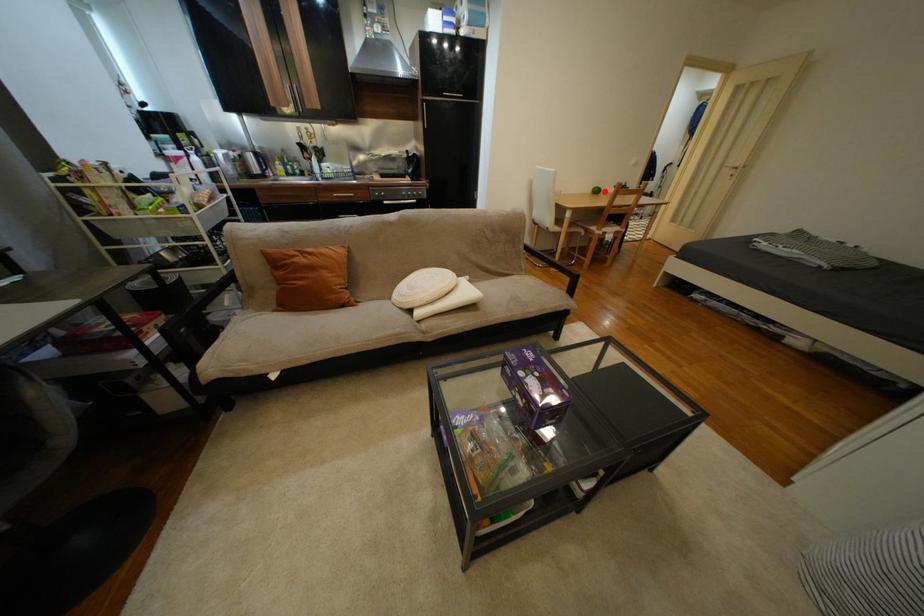
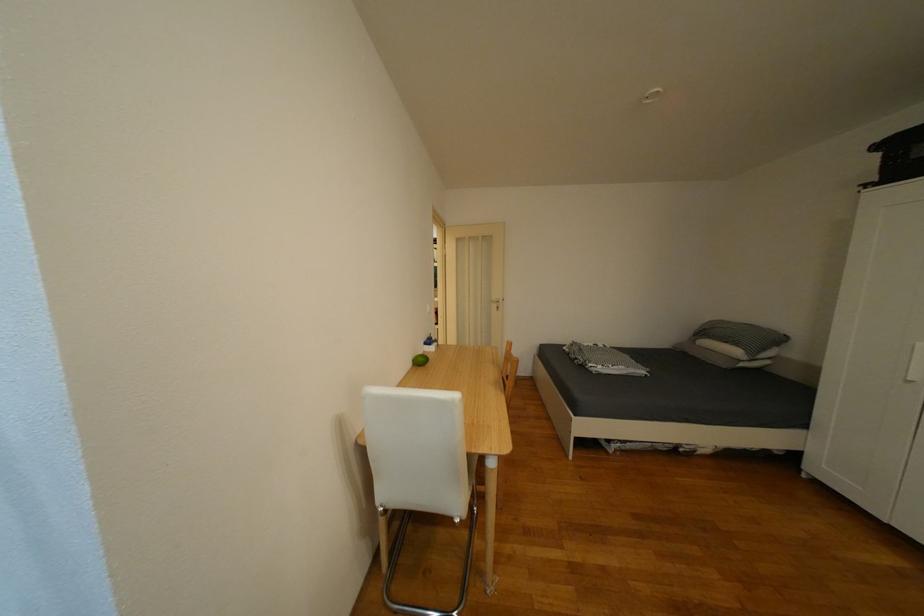
The point at the highlighted location is marked in the first image. Where is the corresponding point in the second image?

(431, 361)